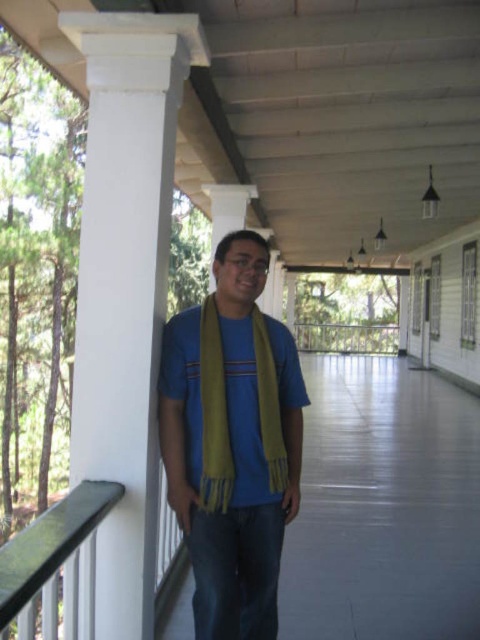
You are standing on the porch and want to place a small potted plant between the two points, point (83, 531) and point (204, 342). Which point should the plant be closer to in order to be nearer to the viewer?

The plant should be closer to point (83, 531) because it is closer to the viewer than point (204, 342).

You are a fashion stylist observing a man on a porch wearing two scarves. The man has a yellow scarf at center and a green soft scarf at center. Which scarf should you recommend removing if you want to create a more minimalist look?

The yellow scarf at center is larger in size than the green soft scarf at center, so removing the yellow scarf at center would create a more minimalist look by reducing the visual bulk.